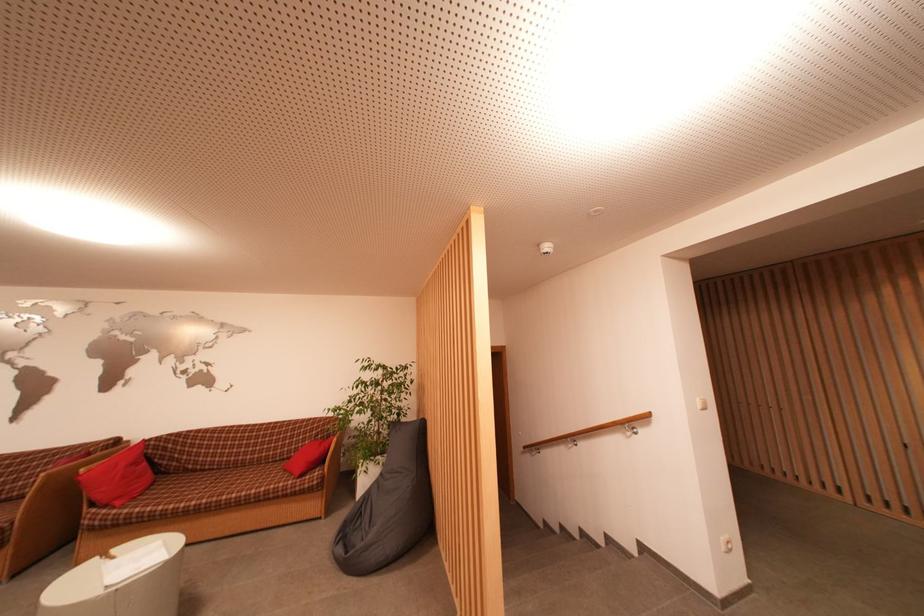
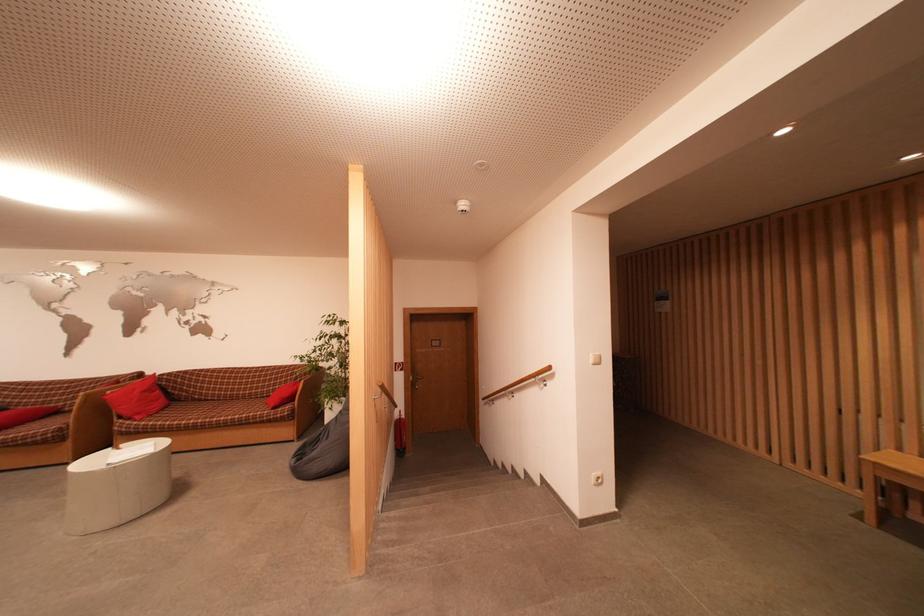
Question: The images are taken continuously from a first-person perspective. In which direction is your viewpoint rotating?

Choices:
 (A) Left
 (B) Right
 (C) Up
 (D) Down

Answer: (D)